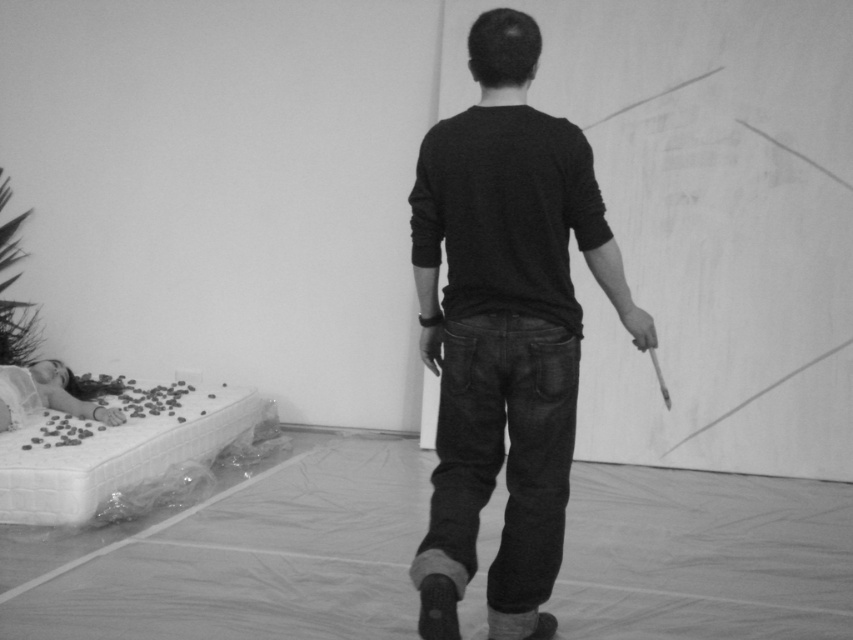
You are standing at the entrance of the art gallery and notice two points marked in the scene. The first point is at coordinate point (491, 252) and the second is at coordinate point (83, 388). Which point is closer to you as you face the gallery entrance?

Point (491, 252) is in front of point (83, 388), so it is closer to you as you face the gallery entrance.

Looking at this image, you are an art curator examining this black and white photograph of an art installation. You notice the black matte shirt at center and the smooth white doll at lower left. Based on their positions, which object is covering part of the other?

The black matte shirt at center is positioned over the smooth white doll at lower left, so it is covering part of the smooth white doll at lower left.

You are an art curator examining this black and white photo. You notice the black matte shirt at center and the smooth white doll at lower left. Which object in the scene is bigger?

The black matte shirt at center is larger than the smooth white doll at lower left.